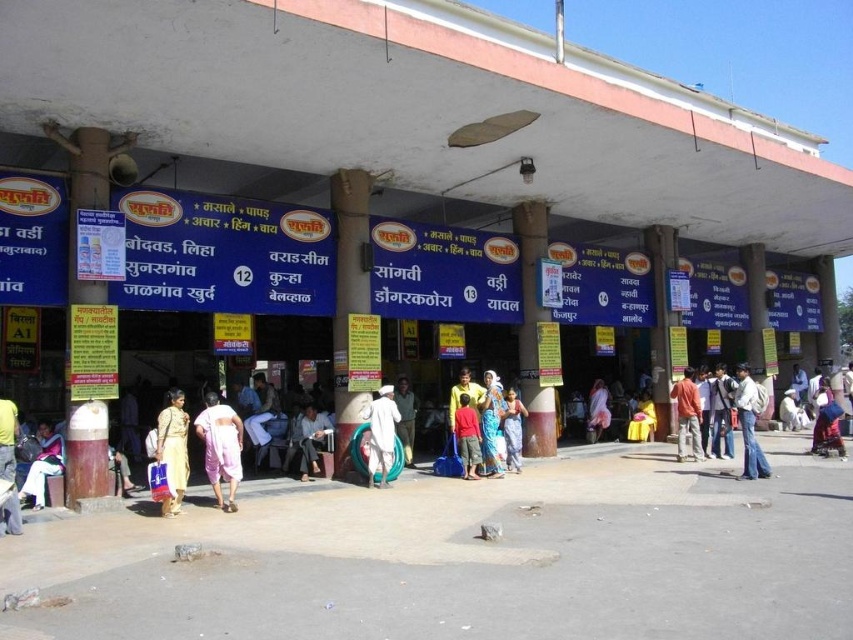
Between blue printed saree at center and orange cotton shirt at center, which one appears on the right side from the viewer's perspective?

orange cotton shirt at center

Between point (498, 433) and point (686, 422), which one is positioned in front?

Point (498, 433) is in front.

The height and width of the screenshot is (640, 853). Identify the location of blue printed saree at center. (491, 422).

Between pink fabric saree at center and blue fabric dress at lower right, which one has less height?

blue fabric dress at lower right is shorter.

Based on the photo, which is above, pink fabric saree at center or blue fabric dress at lower right?

Positioned higher is pink fabric saree at center.

Which is in front, point (199, 429) or point (816, 426)?

Point (199, 429)

Identify the location of pink fabric saree at center. (219, 448).

Is point (314, 467) behind point (456, 436)?

That is True.

Who is positioned more to the left, blue fabric bag at center or red cotton shirt at center?

From the viewer's perspective, blue fabric bag at center appears more on the left side.

Who is more distant from viewer, [308,460] or [463,417]?

The point [308,460] is more distant.

Find the location of a particular element. Image resolution: width=853 pixels, height=640 pixels. blue fabric bag at center is located at coordinates (310, 438).